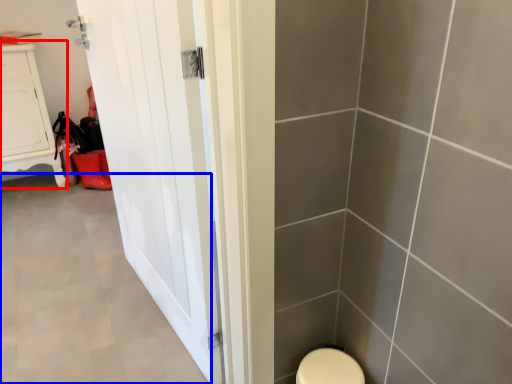
Question: Which object appears farthest to the camera in this image, furniture (highlighted by a red box) or plain (highlighted by a blue box)?

Choices:
 (A) furniture
 (B) plain

Answer: (A)